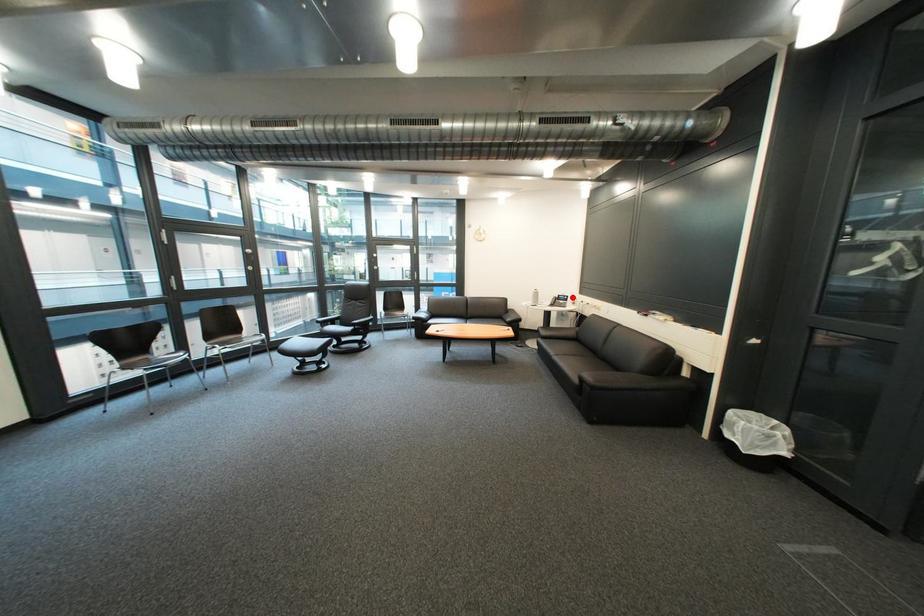
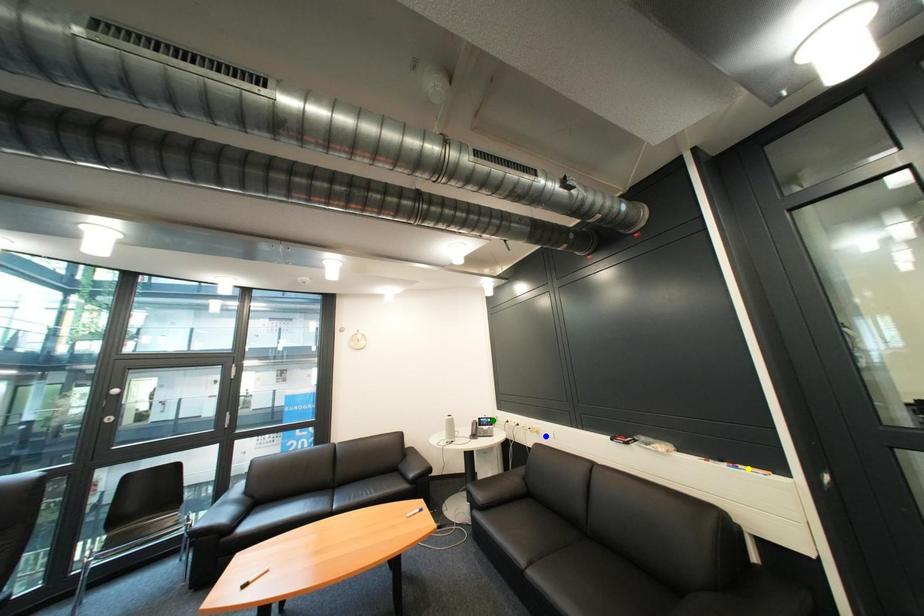
Question: I am providing you with two images of the same scene from different viewpoints. A red point is marked on the first image. You are given multiple points on the second image. Which mark in image 2 goes with the point in image 1?

Choices:
 (A) green point
 (B) blue point
 (C) yellow point

Answer: (A)